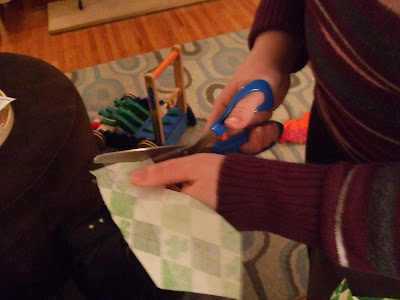
The width and height of the screenshot is (400, 300). Identify the location of sheet. (178, 229).